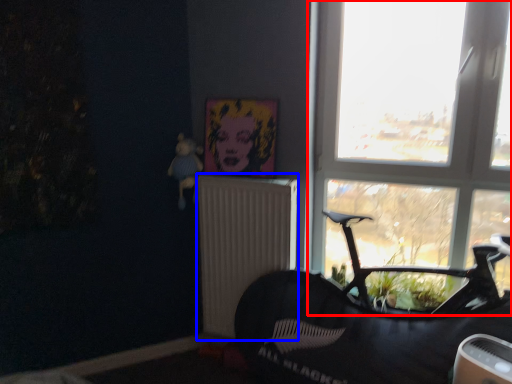
Question: Among these objects, which one is nearest to the camera, window (highlighted by a red box) or radiator (highlighted by a blue box)?

Choices:
 (A) window
 (B) radiator

Answer: (A)